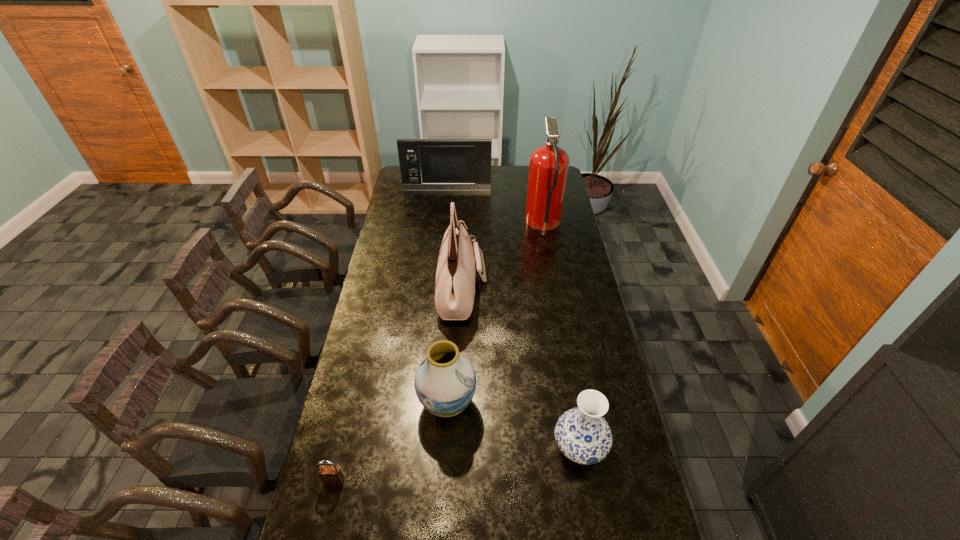
Where is `vacant area at the left edge`? Image resolution: width=960 pixels, height=540 pixels. vacant area at the left edge is located at coordinates (393, 363).

Identify the location of vacant region at the right edge of the desktop. The image size is (960, 540). (599, 463).

Identify the location of empty location between the handbag and the nearest object. (398, 386).

Find the location of a particular element. vacant space that's between the left vase and the shortest object is located at coordinates (391, 442).

At what (x,y) coordinates should I click in order to perform the action: click on vacant space that is in between the handbag and the second farthest object. Please return your answer as a coordinate pair (x, y). The height and width of the screenshot is (540, 960). Looking at the image, I should click on (503, 258).

The width and height of the screenshot is (960, 540). I want to click on vacant region between the fire extinguisher and the right vase, so click(x=562, y=336).

Find the location of `vacant point located between the farthest object and the right vase`. vacant point located between the farthest object and the right vase is located at coordinates (514, 319).

You are a GUI agent. You are given a task and a screenshot of the screen. Output one action in this format:
    pyautogui.click(x=<x>, y=<y>)
    Task: Click on the vacant area between the left vase and the right vase
    
    Given the screenshot: What is the action you would take?
    pyautogui.click(x=514, y=426)

Locate an element on the screen. empty space that is in between the nearest object and the left vase is located at coordinates (391, 442).

Where is `free space between the farthest object and the nearest object`? free space between the farthest object and the nearest object is located at coordinates (391, 335).